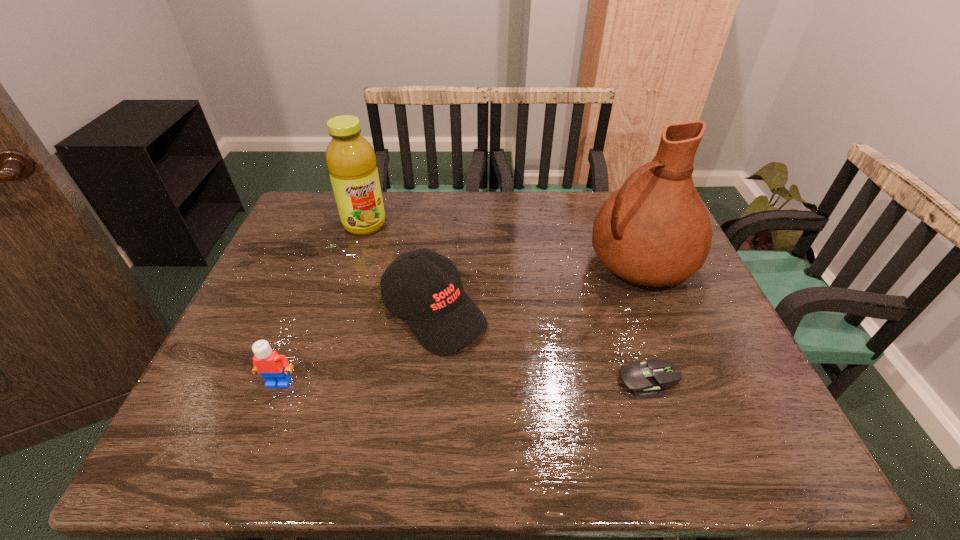
The image size is (960, 540). I want to click on free space on the desktop that is between the Lego and the computer mouse and is positioned on the front label of the fourth shortest object, so click(x=439, y=381).

Identify the location of free space on the desktop that is between the Lego and the computer mouse and is positioned on the front-facing side of the baseball cap. (516, 381).

What are the coordinates of `vacant space on the desktop that is between the Lego and the computer mouse and is positioned on the side of the pitcher with the handle` in the screenshot? It's located at (410, 382).